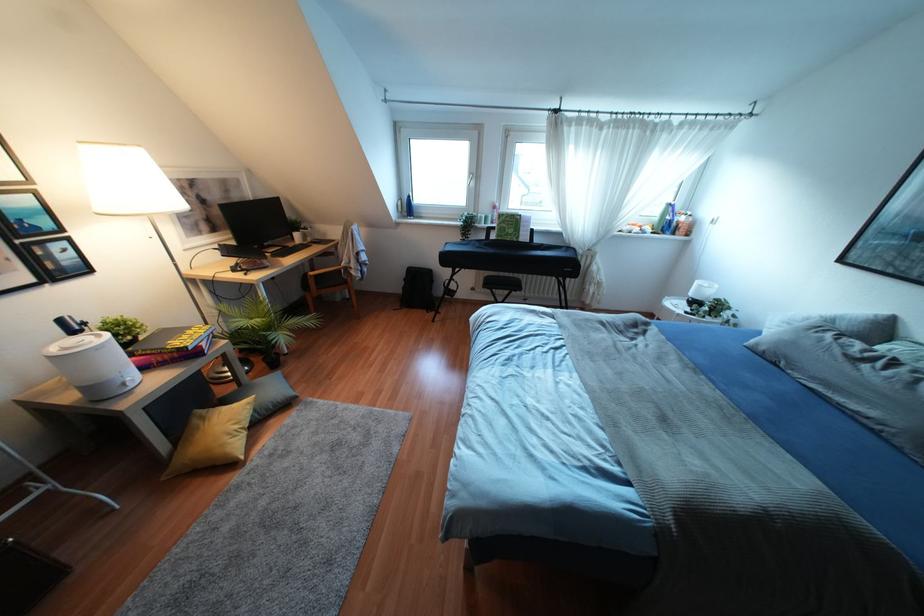
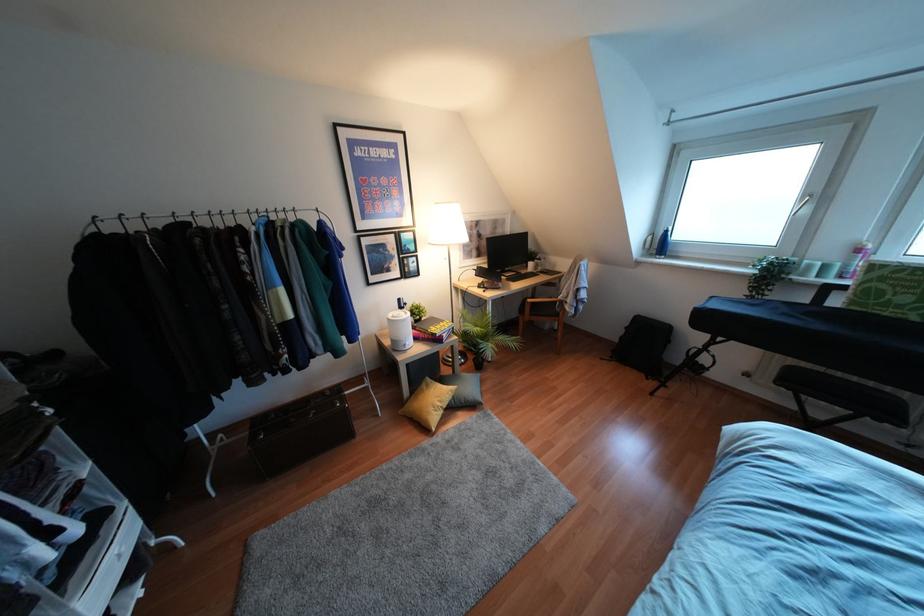
In the second image, find the point that corresponds to [407,208] in the first image.

(660, 245)